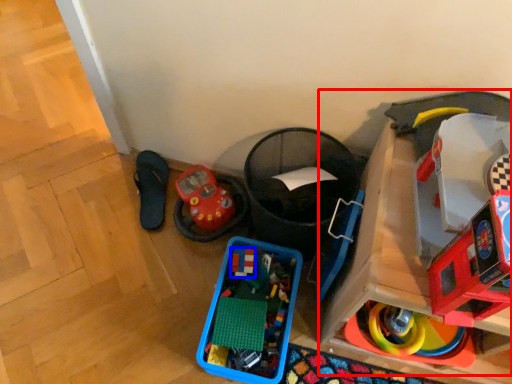
Question: Which point is closer to the camera, toy (highlighted by a red box) or toy (highlighted by a blue box)?

Choices:
 (A) toy
 (B) toy

Answer: (A)